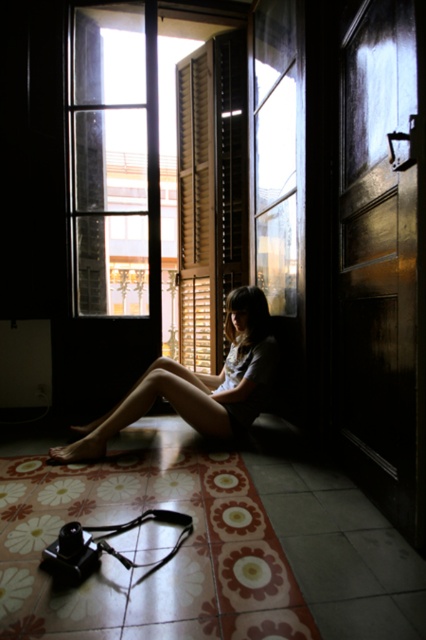
You are a photographer who needs to adjust the camera settings based on the distance between the matte skin girl at center and the camera. The camera requires a minimum distance of 10 feet for optimal focus. Can you use this camera setup as it is?

The matte skin girl at center and camera are 8.36 feet apart from each other. Since the required minimum distance is 10 feet, the camera setup is too close for optimal focus. You need to move further away or adjust the camera settings.

You are a photographer trying to capture the matte skin girl at center and the wooden at center in the same frame. Based on their sizes, which object should you focus on first to ensure both are in focus?

The matte skin girl at center is bigger than wooden at center, so you should focus on the matte skin girl at center first to ensure both are in focus.